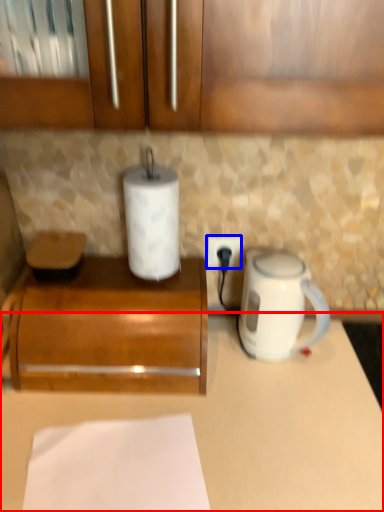
Question: Which of the following is the closest to the observer, counter (highlighted by a red box) or power outlet (highlighted by a blue box)?

Choices:
 (A) counter
 (B) power outlet

Answer: (A)